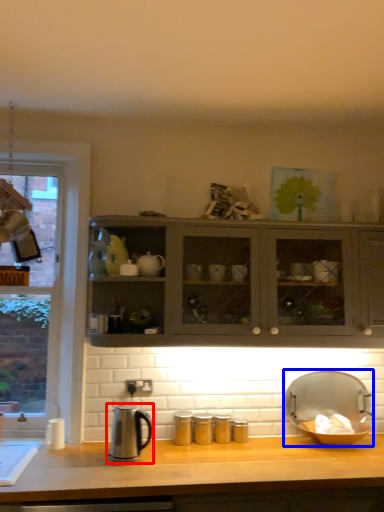
Question: Which object appears closest to the camera in this image, kitchen appliance (highlighted by a red box) or appliance (highlighted by a blue box)?

Choices:
 (A) kitchen appliance
 (B) appliance

Answer: (A)